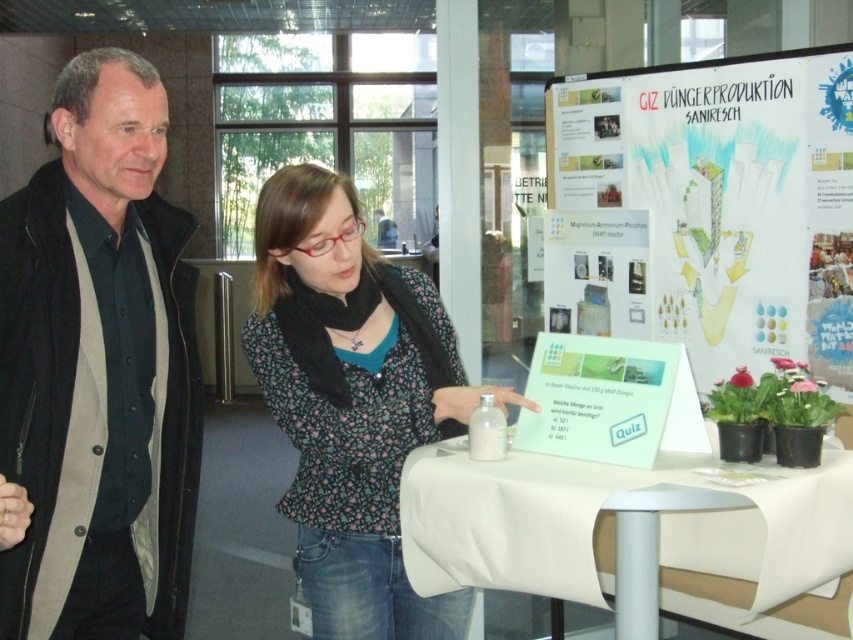
Question: Is white paperboard at upper center positioned at the back of white fabric table at center?

Choices:
 (A) yes
 (B) no

Answer: (A)

Question: Observing the image, what is the correct spatial positioning of white paperboard at upper center in reference to floral fabric blouse at center?

Choices:
 (A) right
 (B) left

Answer: (A)

Question: Which point is closer to the camera?

Choices:
 (A) (733, 563)
 (B) (57, 81)
 (C) (665, 284)
 (D) (409, 612)

Answer: (B)

Question: Which point is closer to the camera?

Choices:
 (A) white paperboard at upper center
 (B) black matte jacket at left
 (C) white fabric table at center

Answer: (B)

Question: Which point is farther from the camera taking this photo?

Choices:
 (A) (491, 516)
 (B) (149, 342)

Answer: (B)

Question: Can you confirm if white paperboard at upper center is thinner than white fabric table at center?

Choices:
 (A) yes
 (B) no

Answer: (A)